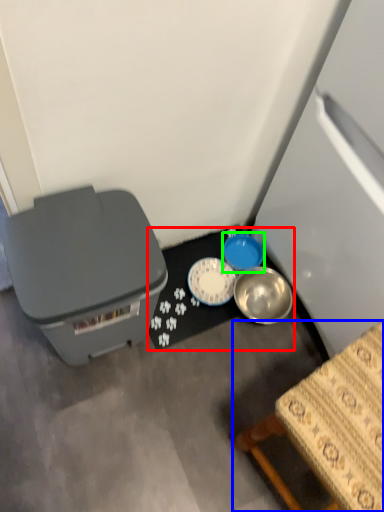
Question: Based on their relative distances, which object is nearer to table (highlighted by a red box)? Choose from furniture (highlighted by a blue box) and bowl (highlighted by a green box).

Choices:
 (A) furniture
 (B) bowl

Answer: (B)